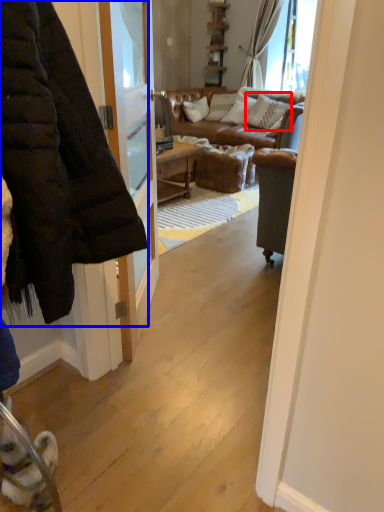
Question: Which point is closer to the camera, pillow (highlighted by a red box) or jacket (highlighted by a blue box)?

Choices:
 (A) pillow
 (B) jacket

Answer: (B)